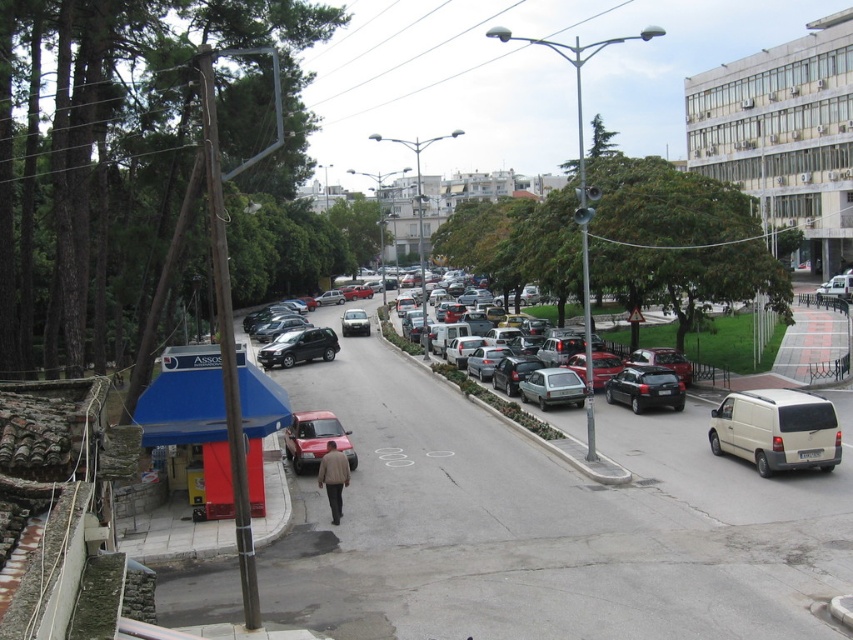
Question: Which point is closer to the camera?

Choices:
 (A) satin black hatchback at center
 (B) white matte van at right
 (C) matte red car at center
 (D) metallic red car at center

Answer: (B)

Question: Which is nearer to the satin silver hatchback at center?

Choices:
 (A) satin black hatchback at center
 (B) silver metallic sedan at center

Answer: (A)

Question: Which point is farther to the camera?

Choices:
 (A) (331, 513)
 (B) (309, 326)

Answer: (B)

Question: Can you confirm if white matte van at right is positioned to the left of matte red car at center?

Choices:
 (A) yes
 (B) no

Answer: (B)

Question: Does brown fabric jacket at center have a greater width compared to matte red car at center?

Choices:
 (A) no
 (B) yes

Answer: (A)

Question: Can you confirm if brown fabric jacket at center is positioned to the right of matte red car at center?

Choices:
 (A) yes
 (B) no

Answer: (A)